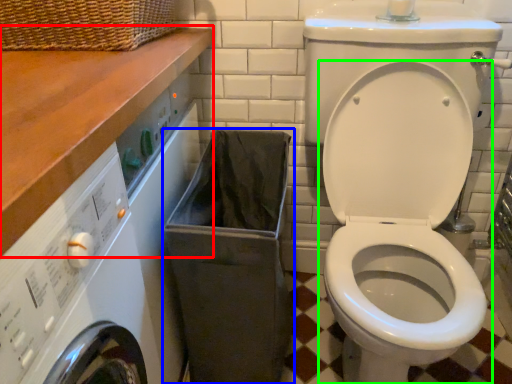
Question: Considering the real-world distances, which object is closest to counter top (highlighted by a red box)? laundry basket (highlighted by a blue box) or toilet (highlighted by a green box).

Choices:
 (A) laundry basket
 (B) toilet

Answer: (A)